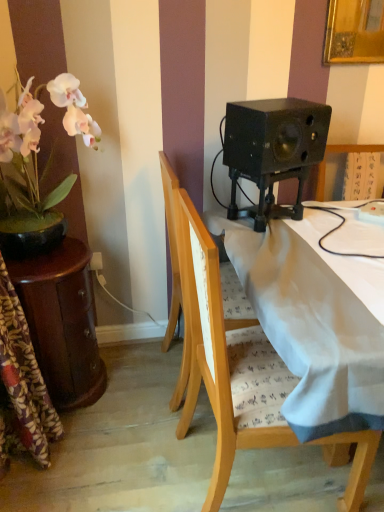
Locate an element on the screen. vacant area on top of mahogany wooden side table at left (from a real-world perspective) is located at coordinates (49, 254).